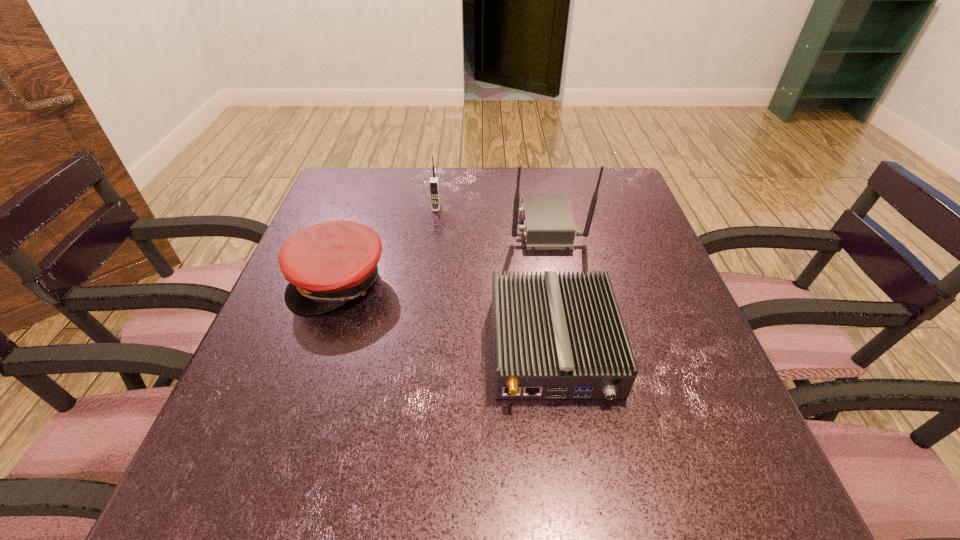
At what (x,y) coordinates should I click in order to perform the action: click on free location located 0.330m on the front-facing side of the second object from left to right. Please return your answer as a coordinate pair (x, y). The image size is (960, 540). Looking at the image, I should click on (424, 303).

This screenshot has height=540, width=960. Find the location of `vacant point located 0.130m on the front-facing side of the leftmost object`. vacant point located 0.130m on the front-facing side of the leftmost object is located at coordinates (309, 370).

Locate an element on the screen. free space located on the back panel of the shorter router is located at coordinates (570, 463).

The width and height of the screenshot is (960, 540). I want to click on router located at the far edge, so click(548, 222).

Identify the location of cellular telephone situated at the far edge. The width and height of the screenshot is (960, 540). (434, 180).

Locate an element on the screen. The width and height of the screenshot is (960, 540). object that is at the left edge is located at coordinates click(x=327, y=265).

Identify the location of vacant space at the far edge of the desktop. The width and height of the screenshot is (960, 540). (467, 190).

Find the location of `free space at the near edge of the desktop`. free space at the near edge of the desktop is located at coordinates (357, 505).

At what (x,y) coordinates should I click in order to perform the action: click on vacant space at the right edge of the desktop. Please return your answer as a coordinate pair (x, y). Looking at the image, I should click on (642, 261).

In the image, there is a desktop. Where is `vacant area at the near left corner`? The width and height of the screenshot is (960, 540). vacant area at the near left corner is located at coordinates (189, 505).